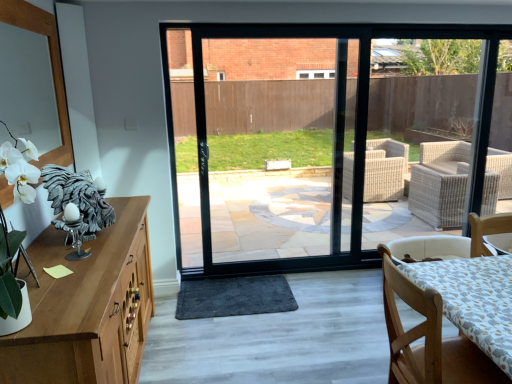
This screenshot has width=512, height=384. What do you see at coordinates (428, 338) in the screenshot?
I see `wooden chair at lower right` at bounding box center [428, 338].

Identify the location of wooden chair at lower right. (428, 338).

Image resolution: width=512 pixels, height=384 pixels. Describe the element at coordinates (234, 297) in the screenshot. I see `dark gray plush mat at center` at that location.

Identify the location of dark gray plush mat at center. (234, 297).

Where is `wooden chair at lower right`? wooden chair at lower right is located at coordinates (428, 338).

Visually, is dark gray plush mat at center positioned to the left or to the right of wooden chair at lower right?

dark gray plush mat at center is positioned on wooden chair at lower right's left side.

Considering their positions, is dark gray plush mat at center located in front of or behind wooden chair at lower right?

In the image, dark gray plush mat at center appears behind wooden chair at lower right.

Which is behind, point (272, 284) or point (407, 293)?

The point (272, 284) is behind.

From the image's perspective, is dark gray plush mat at center located above or below wooden chair at lower right?

dark gray plush mat at center is situated lower than wooden chair at lower right in the image.

From the picture: From a real-world perspective, who is located higher, dark gray plush mat at center or wooden chair at lower right?

wooden chair at lower right, from a real-world perspective.

Is dark gray plush mat at center wider than wooden chair at lower right?

Yes.

Who is taller, dark gray plush mat at center or wooden chair at lower right?

wooden chair at lower right is taller.

Considering the sizes of dark gray plush mat at center and wooden chair at lower right in the image, is dark gray plush mat at center bigger or smaller than wooden chair at lower right?

In the image, dark gray plush mat at center appears to be smaller than wooden chair at lower right.

Is wooden chair at lower right inside dark gray plush mat at center?

No, dark gray plush mat at center does not contain wooden chair at lower right.

Are dark gray plush mat at center and wooden chair at lower right making contact?

dark gray plush mat at center and wooden chair at lower right are clearly separated.

Could you tell me if dark gray plush mat at center is facing wooden chair at lower right?

No, dark gray plush mat at center does not turn towards wooden chair at lower right.

Can you tell me how much dark gray plush mat at center and wooden chair at lower right differ in facing direction?

90.3 degrees separate the facing orientations of dark gray plush mat at center and wooden chair at lower right.

Looking at this image, how far apart are dark gray plush mat at center and wooden chair at lower right?

dark gray plush mat at center is 1.52 meters away from wooden chair at lower right.

At what (x,y) coordinates should I click in order to perform the action: click on chair above the dark gray plush mat at center (from the image's perspective). Please return your answer as a coordinate pair (x, y). Looking at the image, I should click on (428, 338).

Can you confirm if wooden chair at lower right is positioned to the right of dark gray plush mat at center?

Correct, you'll find wooden chair at lower right to the right of dark gray plush mat at center.

In the image, is wooden chair at lower right positioned in front of or behind dark gray plush mat at center?

Clearly, wooden chair at lower right is in front of dark gray plush mat at center.

Considering the points (428, 353) and (249, 284), which point is behind, point (428, 353) or point (249, 284)?

The point (249, 284) is farther from the camera.

From the image's perspective, between wooden chair at lower right and dark gray plush mat at center, which one is located above?

wooden chair at lower right appears higher in the image.

From a real-world perspective, is wooden chair at lower right positioned under dark gray plush mat at center based on gravity?

No.

Does wooden chair at lower right have a greater width compared to dark gray plush mat at center?

In fact, wooden chair at lower right might be narrower than dark gray plush mat at center.

In terms of height, does wooden chair at lower right look taller or shorter compared to dark gray plush mat at center?

wooden chair at lower right is taller than dark gray plush mat at center.

Is wooden chair at lower right bigger than dark gray plush mat at center?

Yes.

Is dark gray plush mat at center surrounded by wooden chair at lower right?

No.

Is wooden chair at lower right with dark gray plush mat at center?

wooden chair at lower right is not next to dark gray plush mat at center, and they're not touching.

Is wooden chair at lower right facing away from dark gray plush mat at center?

No, wooden chair at lower right's orientation is not away from dark gray plush mat at center.

How many degrees apart are the facing directions of wooden chair at lower right and dark gray plush mat at center?

The angle between the facing direction of wooden chair at lower right and the facing direction of dark gray plush mat at center is 90.3 degrees.

In the image, there is a wooden chair at lower right. Identify the location of wide below it (from a real-world perspective). (234, 297).

The width and height of the screenshot is (512, 384). What are the coordinates of `wide behind the wooden chair at lower right` in the screenshot? It's located at (234, 297).

The image size is (512, 384). Find the location of `chair positioned vertically above the dark gray plush mat at center (from a real-world perspective)`. chair positioned vertically above the dark gray plush mat at center (from a real-world perspective) is located at coordinates (428, 338).